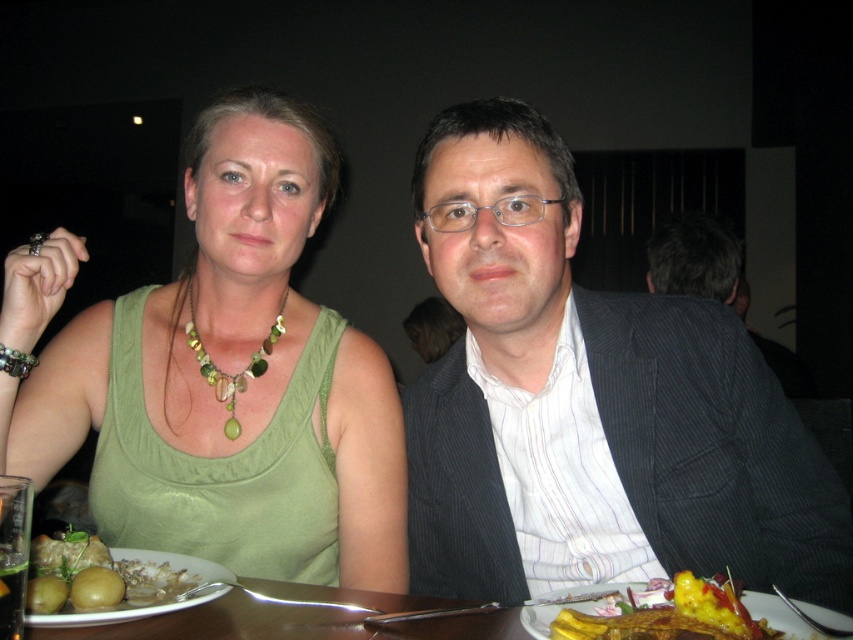
Question: Which point is farther to the camera?

Choices:
 (A) green matte potatoes at lower left
 (B) yellow glazed pastry at lower right

Answer: (A)

Question: Estimate the real-world distances between objects in this image. Which object is closer to the green fabric tank top at left?

Choices:
 (A) green glass beads at center
 (B) yellow glazed pastry at lower right
 (C) dark gray pinstripe suit at center
 (D) green matte potatoes at lower left

Answer: (A)

Question: Which point is farther to the camera?

Choices:
 (A) green matte potatoes at lower left
 (B) green fabric tank top at left

Answer: (B)

Question: Where is green fabric tank top at left located in relation to green glass beads at center in the image?

Choices:
 (A) right
 (B) left

Answer: (B)

Question: Can you confirm if green matte potatoes at lower left is positioned above green glass beads at center?

Choices:
 (A) yes
 (B) no

Answer: (B)

Question: Is green fabric tank top at left further to camera compared to dark gray pinstripe suit at center?

Choices:
 (A) yes
 (B) no

Answer: (A)